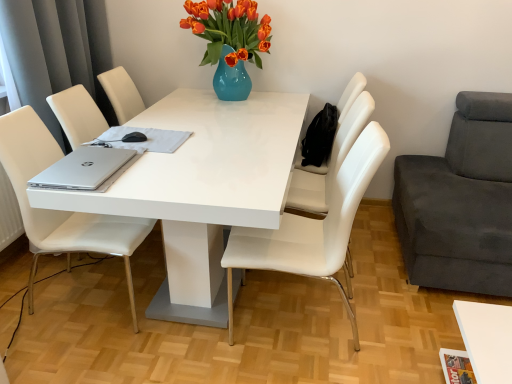
Locate an element on the screen. The width and height of the screenshot is (512, 384). vacant position to the left of white leather chair at center, the 3th chair in the right-to-left sequence is located at coordinates (186, 346).